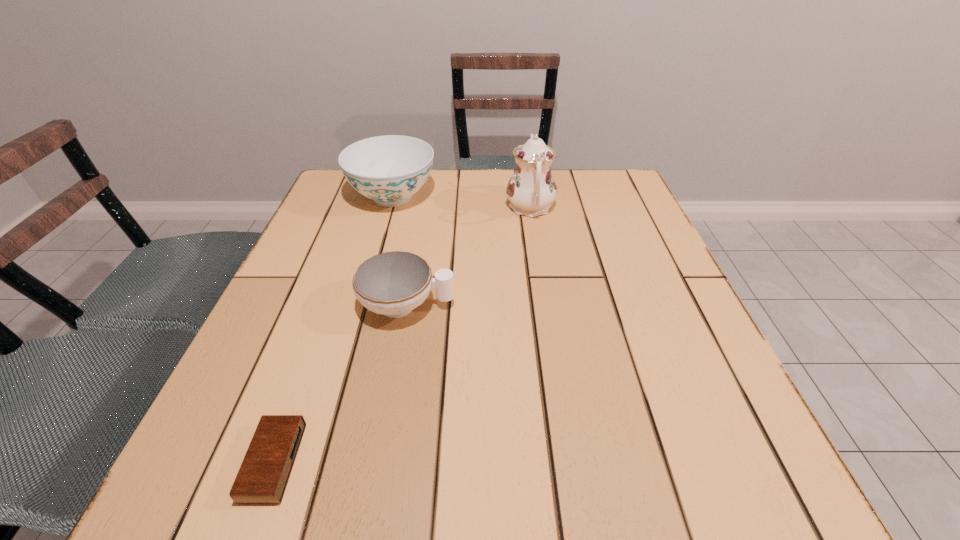
This screenshot has width=960, height=540. Find the location of `vacant space at the far left corner`. vacant space at the far left corner is located at coordinates (325, 202).

In order to click on free region at the near left corner of the desktop in this screenshot , I will do `click(235, 470)`.

Image resolution: width=960 pixels, height=540 pixels. Find the location of `free spot between the alarm clock and the tallest object`. free spot between the alarm clock and the tallest object is located at coordinates (402, 335).

I want to click on vacant area between the nearest object and the rightmost object, so click(402, 335).

Identify the location of free point between the tallest chinaware and the second tallest object. (462, 202).

Identify the location of free space between the nearest chinaware and the alarm clock. Image resolution: width=960 pixels, height=540 pixels. (341, 383).

Locate an element on the screen. vacant area between the shortest object and the rightmost object is located at coordinates [402, 335].

Where is `free spot between the alarm clock and the tallest chinaware`? The image size is (960, 540). free spot between the alarm clock and the tallest chinaware is located at coordinates (402, 335).

At what (x,y) coordinates should I click in order to perform the action: click on the second closest object to the third shortest object. Please return your answer as a coordinate pair (x, y). The image size is (960, 540). Looking at the image, I should click on (394, 283).

The height and width of the screenshot is (540, 960). Identify the location of the second closest object to the second shortest object. pos(531,190).